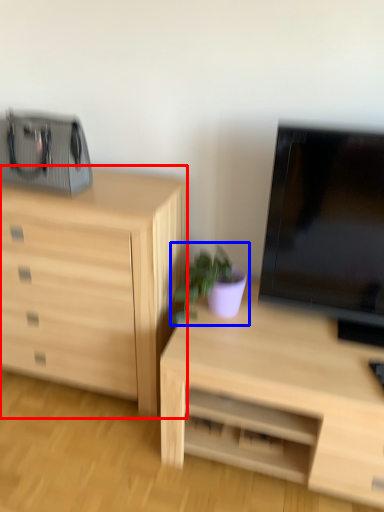
Question: Which point is further to the camera, chest of drawers (highlighted by a red box) or houseplant (highlighted by a blue box)?

Choices:
 (A) chest of drawers
 (B) houseplant

Answer: (B)